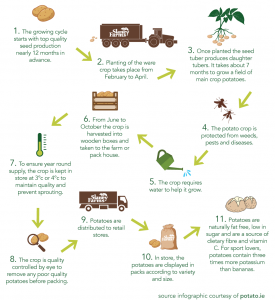
Find the location of `plant`. plant is located at coordinates (221, 23).